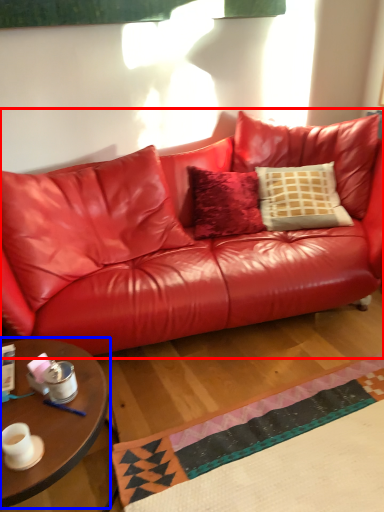
Question: Which of the following is the closest to the observer, studio couch (highlighted by a red box) or coffee table (highlighted by a blue box)?

Choices:
 (A) studio couch
 (B) coffee table

Answer: (B)